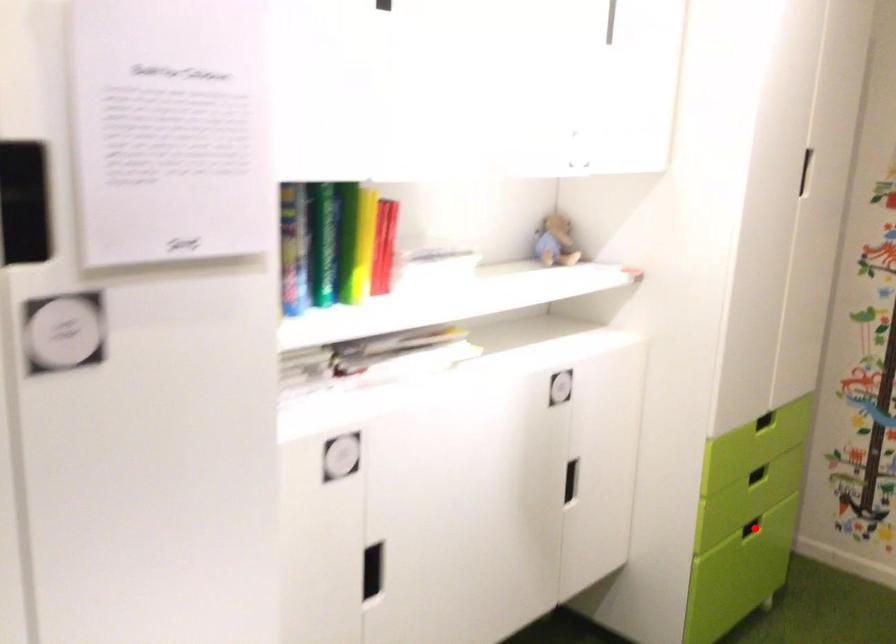
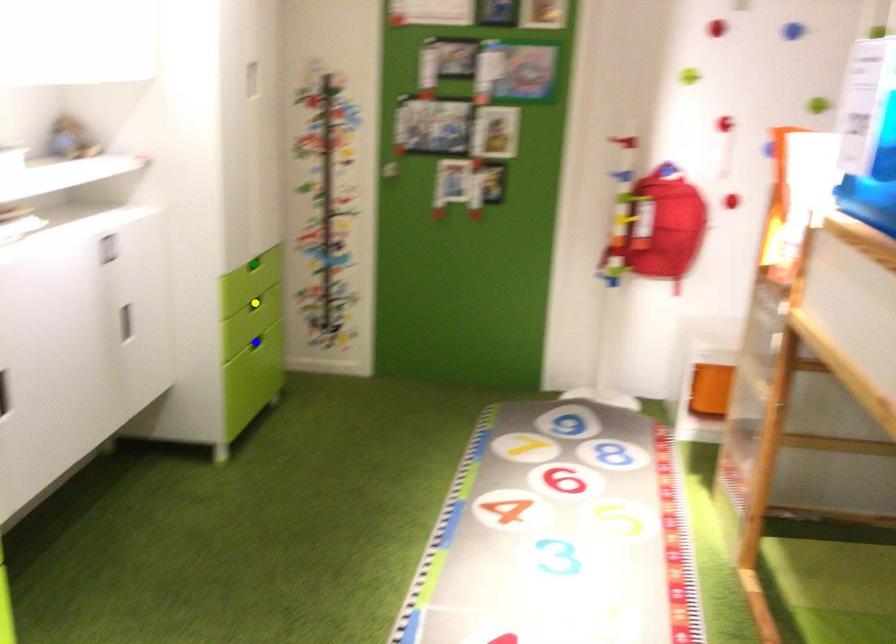
Question: I am providing you with two images of the same scene from different viewpoints. A red point is marked on the first image. You are given multiple points on the second image. Which mark in image 2 goes with the point in image 1?

Choices:
 (A) yellow point
 (B) green point
 (C) blue point

Answer: (C)